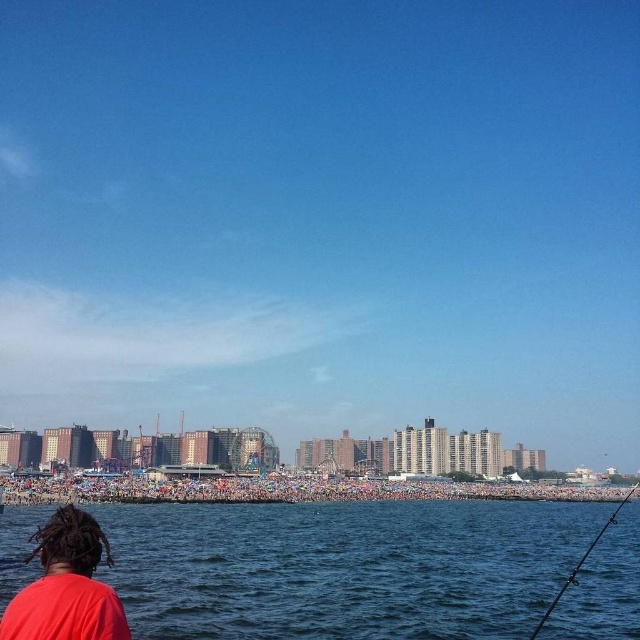
You are standing at the center of the image and want to locate the red matte shirt at lower left. In which direction should you look relative to your current position?

The red matte shirt at lower left is located at point [67,586], so you should look to the lower left direction from your current position at the center.

You are standing at the shoreline and see the blue water at lower center and the red matte shirt at lower left. Which object is closer to your right side?

The blue water at lower center is positioned on the right side of red matte shirt at lower left, so it is closer to your right side.